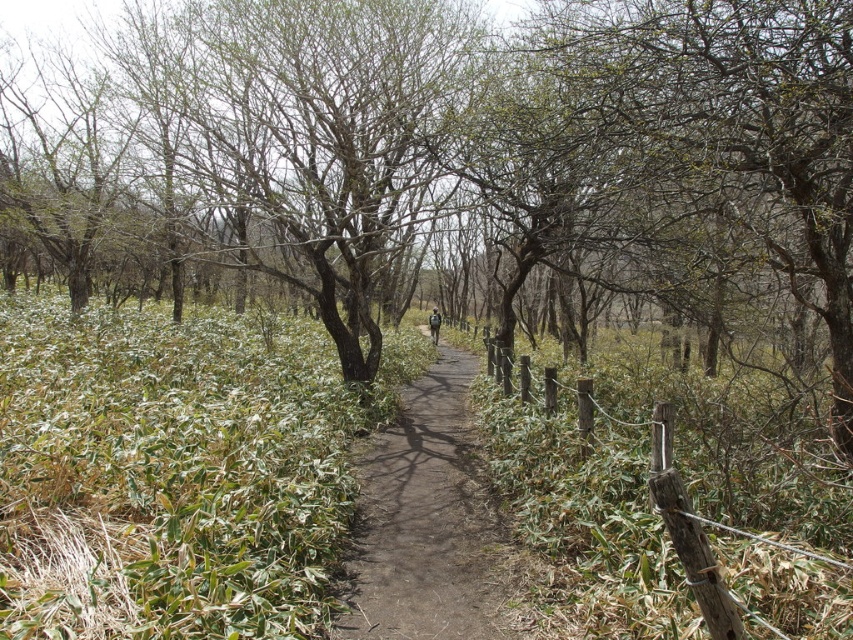
Question: Which of the following is the closest to the observer?

Choices:
 (A) (489, 568)
 (B) (164, 109)

Answer: (A)

Question: Does green leafy shrub at center have a larger size compared to dirt path at center?

Choices:
 (A) yes
 (B) no

Answer: (A)

Question: Is green leafy shrub at center smaller than dirt path at center?

Choices:
 (A) no
 (B) yes

Answer: (A)

Question: Does green leafy shrub at center lie behind dirt path at center?

Choices:
 (A) no
 (B) yes

Answer: (B)